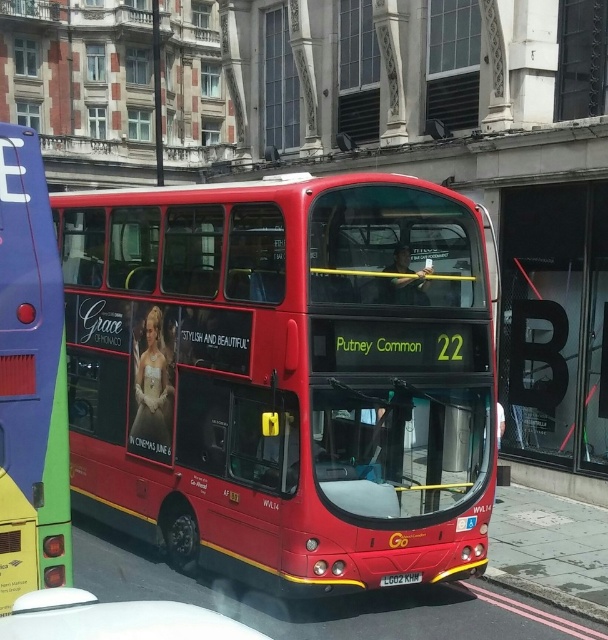
Question: Which point is closer to the camera?

Choices:
 (A) white plastic license plate at center
 (B) shiny red bus at center

Answer: (B)

Question: Estimate the real-world distances between objects in this image. Which object is closer to the white plastic license plate at center?

Choices:
 (A) matte red bus at center
 (B) shiny red bus at center

Answer: (B)

Question: Based on their relative distances, which object is farther from the white plastic license plate at center?

Choices:
 (A) shiny red bus at center
 (B) matte red bus at center

Answer: (B)

Question: Can you confirm if shiny red bus at center is positioned to the right of white plastic license plate at center?

Choices:
 (A) no
 (B) yes

Answer: (A)

Question: Does shiny red bus at center appear on the right side of matte red bus at center?

Choices:
 (A) yes
 (B) no

Answer: (A)

Question: In this image, where is matte red bus at center located relative to white plastic license plate at center?

Choices:
 (A) left
 (B) right

Answer: (A)